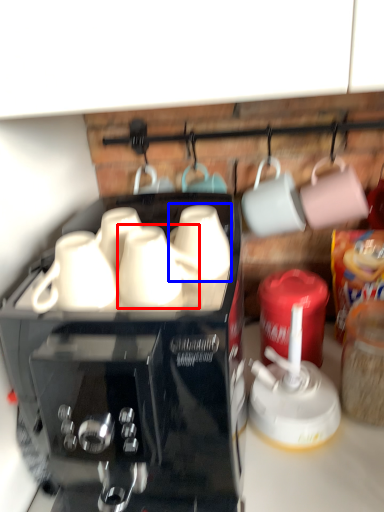
Question: Which object is closer to the camera taking this photo, mug (highlighted by a red box) or mug (highlighted by a blue box)?

Choices:
 (A) mug
 (B) mug

Answer: (A)